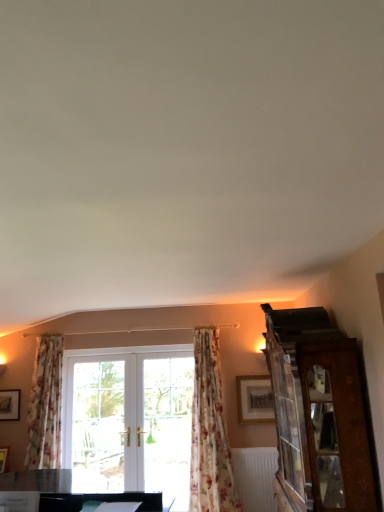
Question: Is floral fabric curtain at center, placed as the second curtain when sorted from left to right, surrounding wooden picture frame at lower left, which is the second picture frame in front-to-back order?

Choices:
 (A) yes
 (B) no

Answer: (B)

Question: Is floral fabric curtain at center, the first curtain from the right, taller than wooden picture frame at lower left, the first picture frame viewed from the back?

Choices:
 (A) yes
 (B) no

Answer: (A)

Question: Is floral fabric curtain at center, the first curtain from the right, to the left of wooden picture frame at lower left, which is the 1th picture frame from left to right, from the viewer's perspective?

Choices:
 (A) no
 (B) yes

Answer: (A)

Question: Is floral fabric curtain at center, placed as the second curtain when sorted from left to right, next to wooden picture frame at lower left, the second picture frame positioned from the right, and touching it?

Choices:
 (A) no
 (B) yes

Answer: (A)

Question: Does floral fabric curtain at center, the first curtain from the right, have a smaller size compared to wooden picture frame at lower left, the first picture frame viewed from the back?

Choices:
 (A) yes
 (B) no

Answer: (B)

Question: Does floral fabric curtain at center, the first curtain from the right, appear on the right side of wooden picture frame at lower left, which is the 1th picture frame from left to right?

Choices:
 (A) yes
 (B) no

Answer: (A)

Question: Does clear glass door at center have a smaller size compared to floral fabric curtain at left, which appears as the first curtain when viewed from the left?

Choices:
 (A) no
 (B) yes

Answer: (B)

Question: Is clear glass door at center not close to floral fabric curtain at left, the second curtain in the right-to-left sequence?

Choices:
 (A) yes
 (B) no

Answer: (B)

Question: Are clear glass door at center and floral fabric curtain at left, which appears as the first curtain when viewed from the left, beside each other?

Choices:
 (A) no
 (B) yes

Answer: (A)

Question: Is clear glass door at center turned away from floral fabric curtain at left, the second curtain in the right-to-left sequence?

Choices:
 (A) no
 (B) yes

Answer: (A)

Question: Is clear glass door at center taller than floral fabric curtain at left, the second curtain in the right-to-left sequence?

Choices:
 (A) no
 (B) yes

Answer: (B)

Question: From the image's perspective, does clear glass door at center appear higher than floral fabric curtain at left, which appears as the first curtain when viewed from the left?

Choices:
 (A) yes
 (B) no

Answer: (B)

Question: Can you confirm if wooden picture frame at lower left, the first picture frame viewed from the back, is taller than wooden cabinet at right?

Choices:
 (A) yes
 (B) no

Answer: (B)